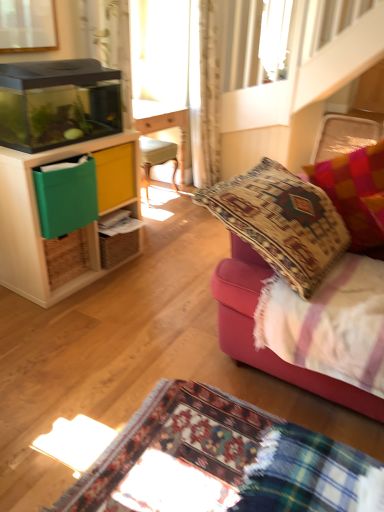
Where is `vacant area that lies between matte wood cabinet at left and velvet cushion at right`? vacant area that lies between matte wood cabinet at left and velvet cushion at right is located at coordinates (154, 302).